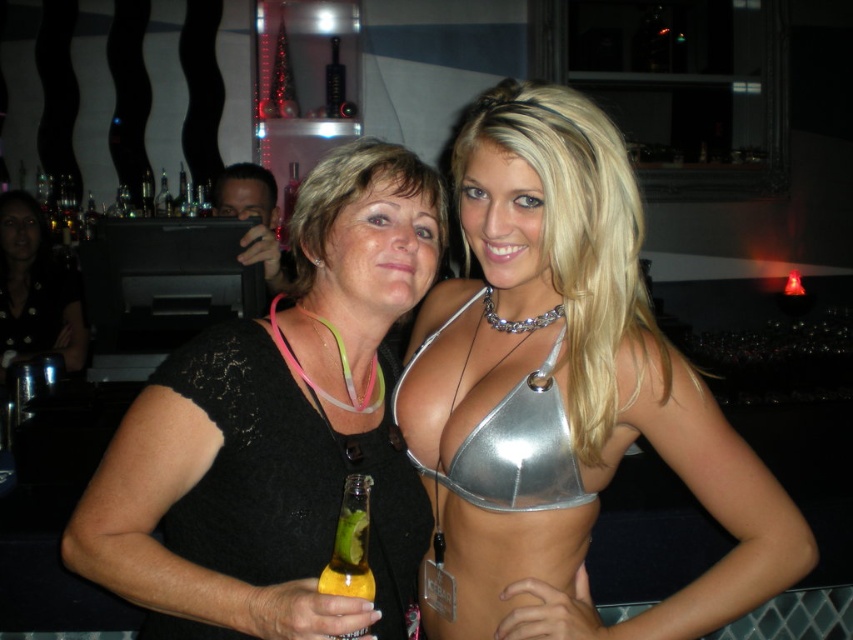
Question: Which point is closer to the camera?

Choices:
 (A) metallic silver top at center
 (B) metallic silver bikini top at center

Answer: (A)

Question: Can you confirm if black lace top at center is bigger than translucent yellow glass bottle at lower left?

Choices:
 (A) yes
 (B) no

Answer: (A)

Question: Which of the following is the farthest from the observer?

Choices:
 (A) black lace top at center
 (B) metallic silver bikini top at center
 (C) black fabric shirt at center
 (D) metallic silver top at center

Answer: (C)

Question: Is black lace top at center positioned at the back of black fabric shirt at center?

Choices:
 (A) no
 (B) yes

Answer: (A)

Question: Can you confirm if black lace top at center is bigger than black fabric shirt at center?

Choices:
 (A) no
 (B) yes

Answer: (A)

Question: Estimate the real-world distances between objects in this image. Which object is closer to the metallic silver top at center?

Choices:
 (A) metallic silver bikini top at center
 (B) black lace top at center
 (C) translucent yellow glass bottle at lower left
 (D) black fabric shirt at center

Answer: (A)